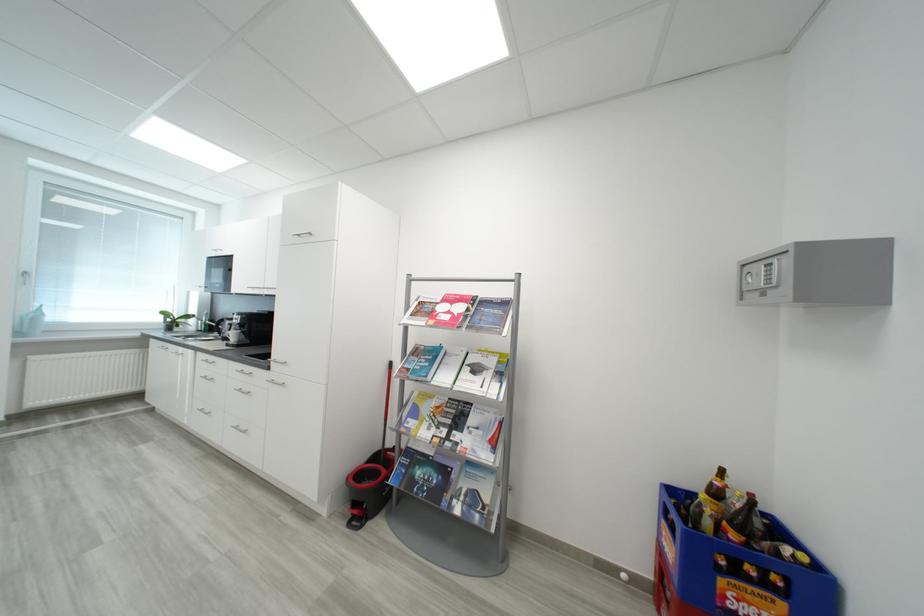
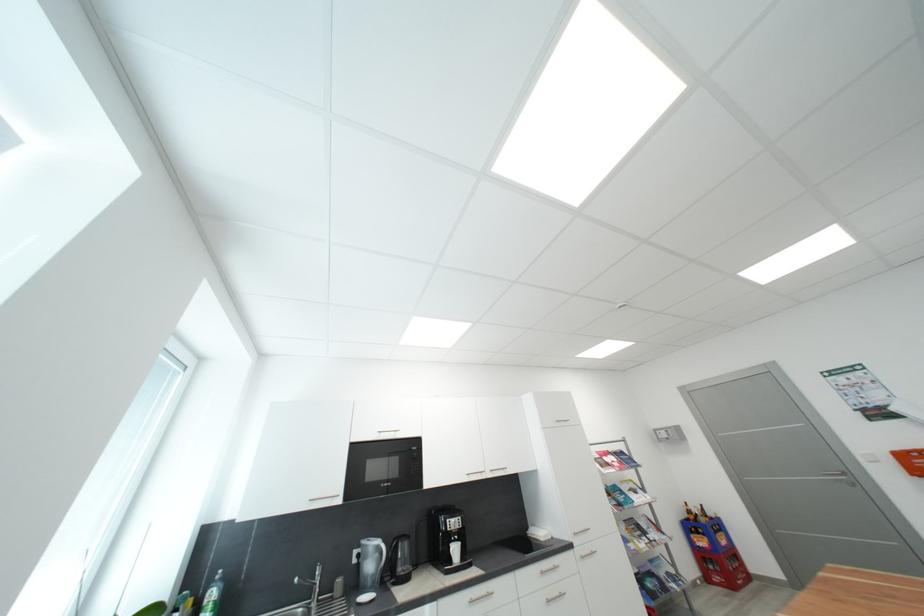
The point at (714,524) is marked in the first image. Where is the corresponding point in the second image?

(710, 522)